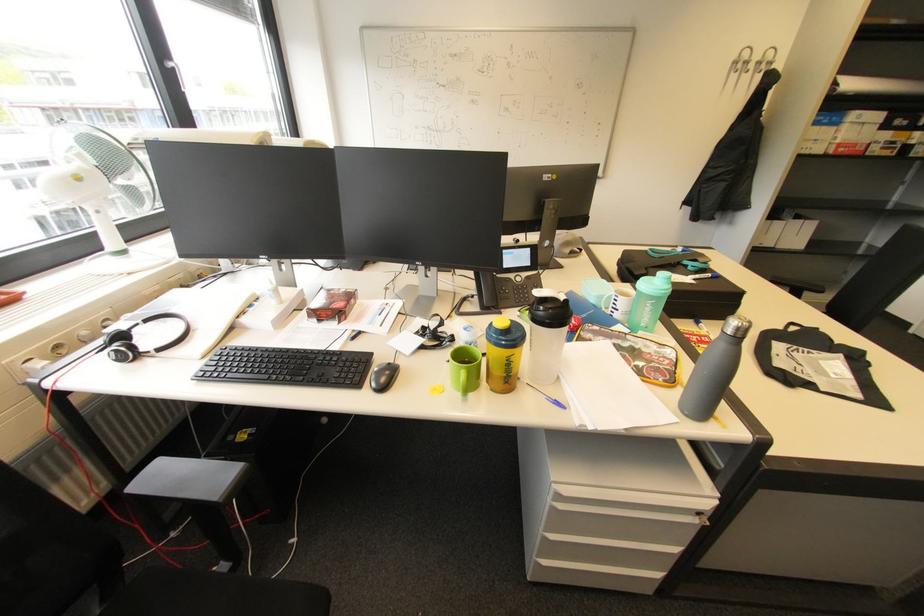
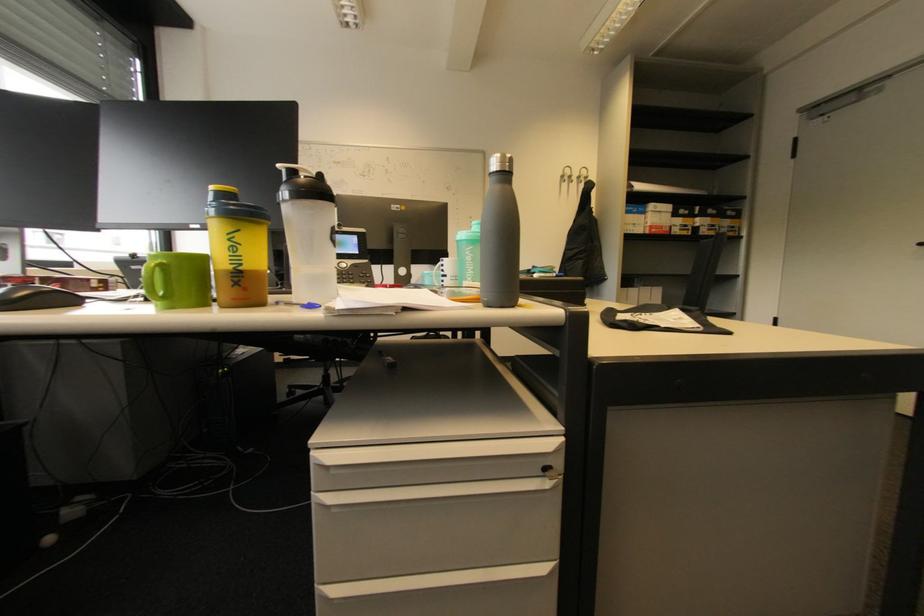
Which direction would the cameraman need to move to produce the second image?

The cameraman walked toward right, forward.